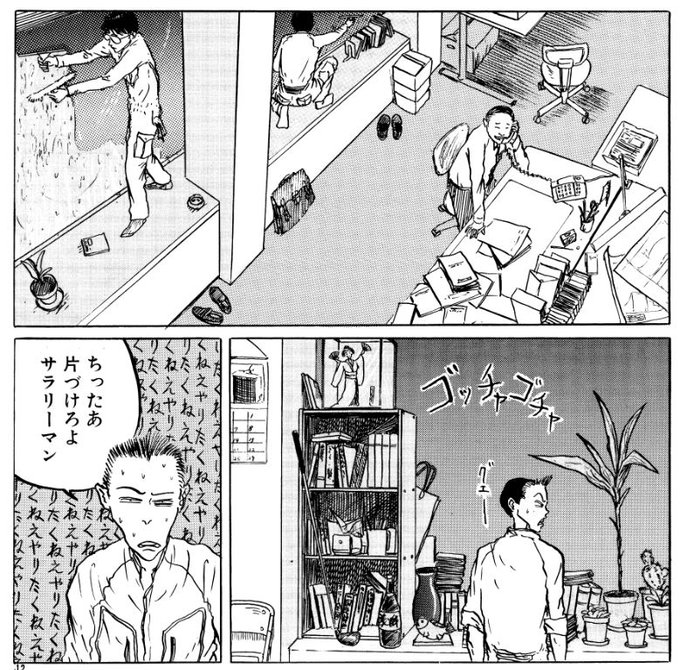
Where is `floor`? This screenshot has height=670, width=680. floor is located at coordinates coord(345,260).